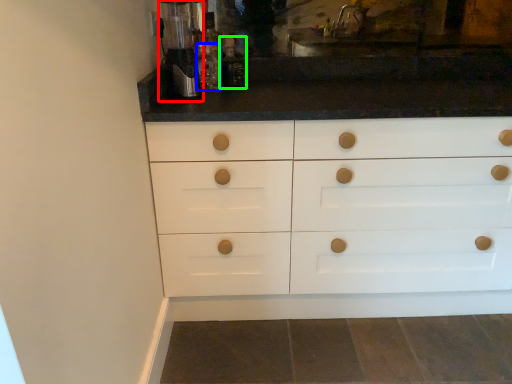
Question: Which object is positioned farthest from coffee machine (highlighted by a red box)? Select from bottle (highlighted by a blue box) and bottle (highlighted by a green box).

Choices:
 (A) bottle
 (B) bottle

Answer: (B)